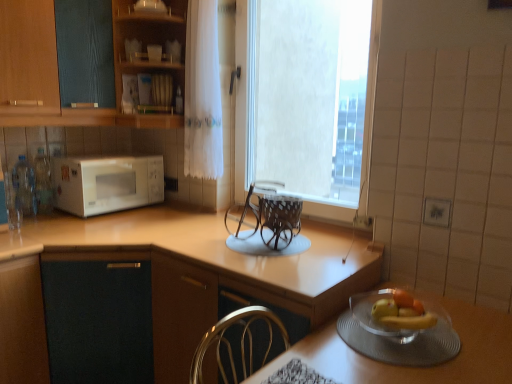
I want to click on free spot to the right of clear glass bottle at left, which is the second bottle from left to right, so click(69, 216).